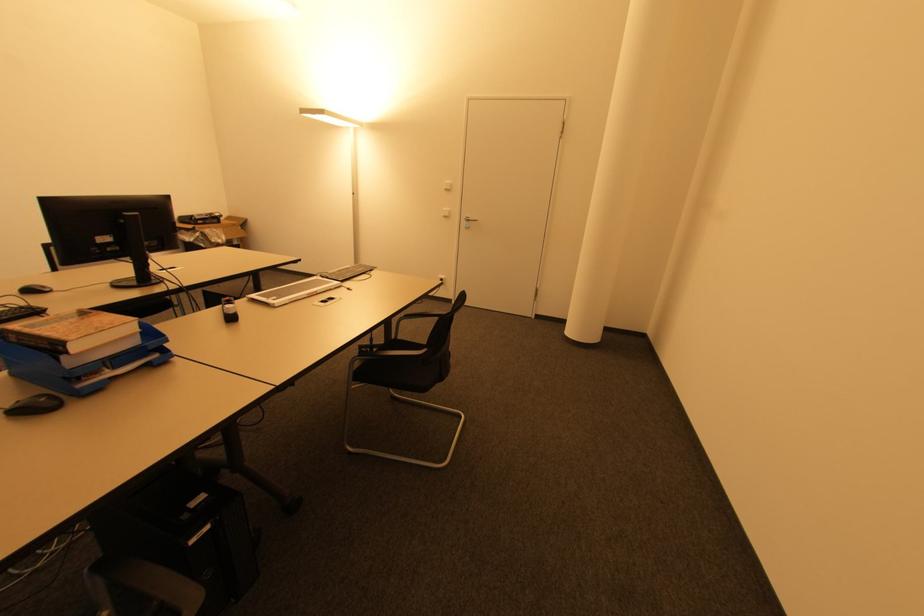
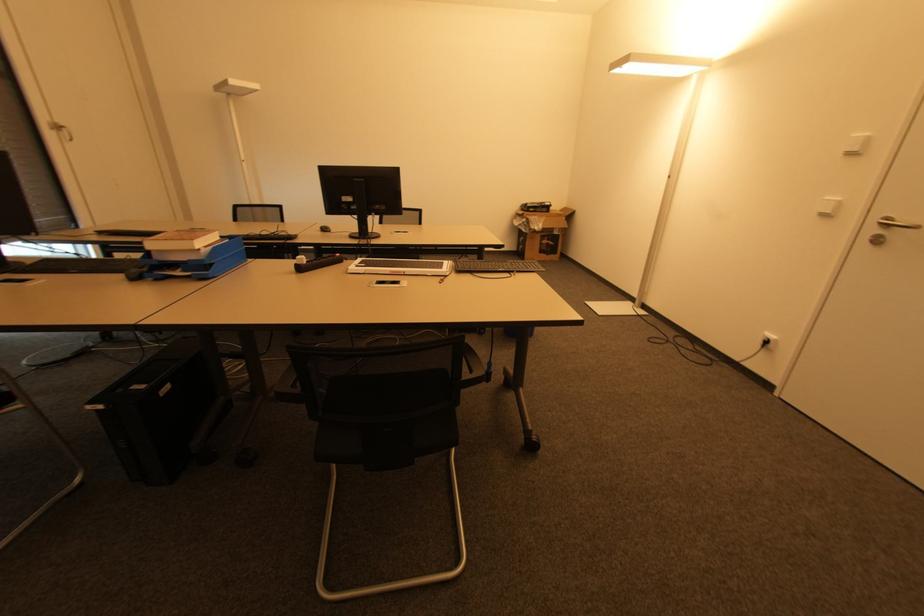
Locate, in the second image, the point that corresponds to (209,529) in the first image.

(101, 408)